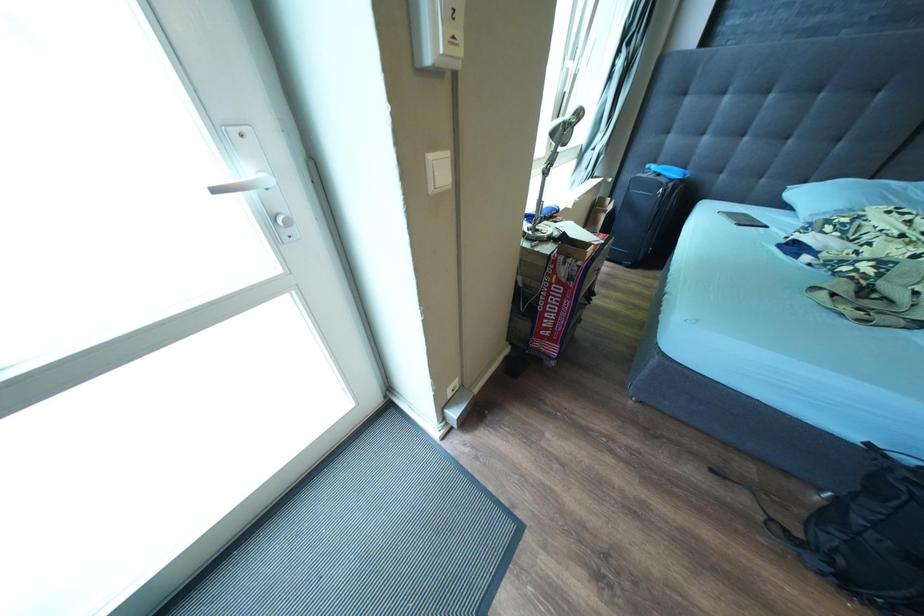
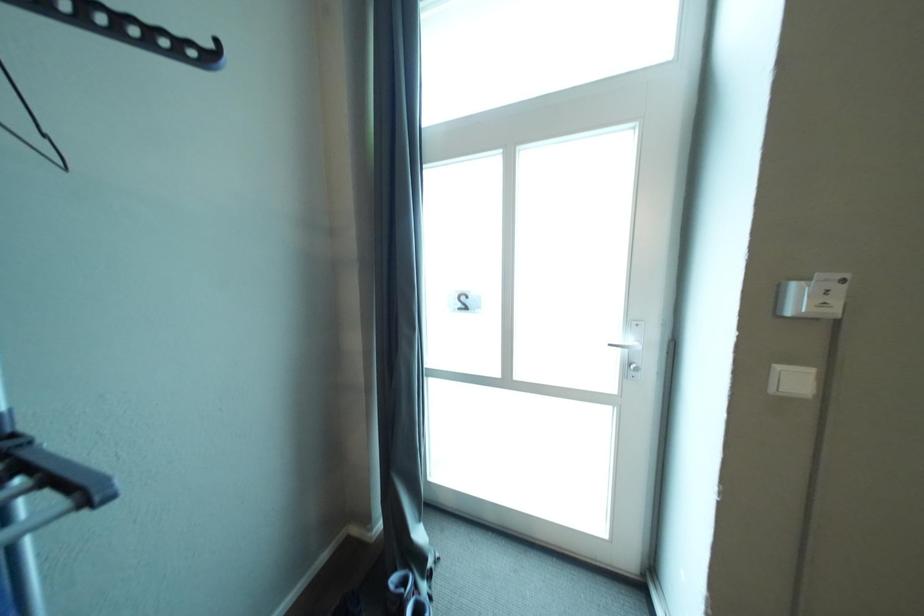
Question: Based on the continuous images, in which direction is the camera rotating? Reply with the corresponding letter.

Choices:
 (A) Left
 (B) Right
 (C) Up
 (D) Down

Answer: (A)